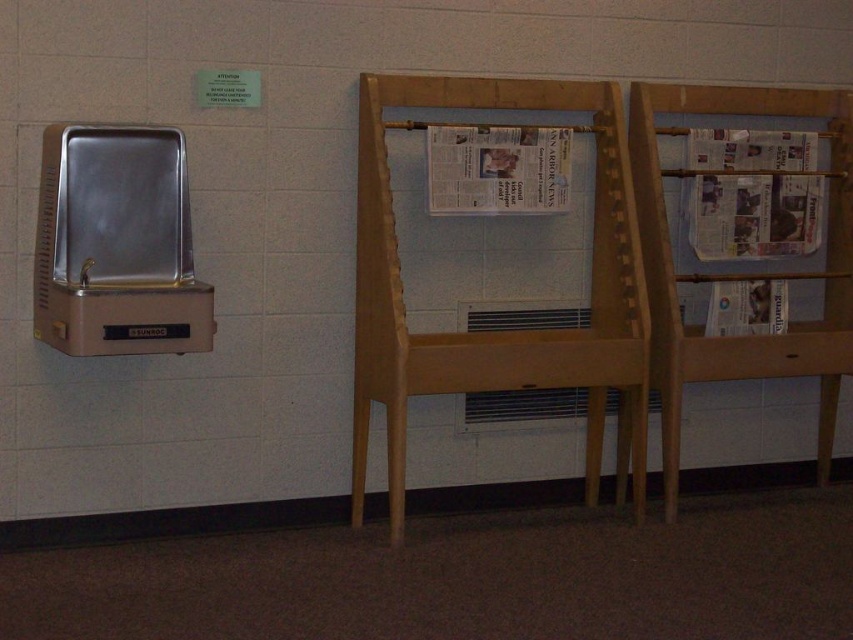
What do you see at coordinates (498, 332) in the screenshot? I see `light brown wooden newspaper rack at center` at bounding box center [498, 332].

Who is lower down, light brown wooden newspaper rack at center or white glossy newspaper at center?

light brown wooden newspaper rack at center is lower down.

I want to click on light brown wooden newspaper rack at center, so click(x=498, y=332).

Identify the location of light brown wooden newspaper rack at center. The width and height of the screenshot is (853, 640). (498, 332).